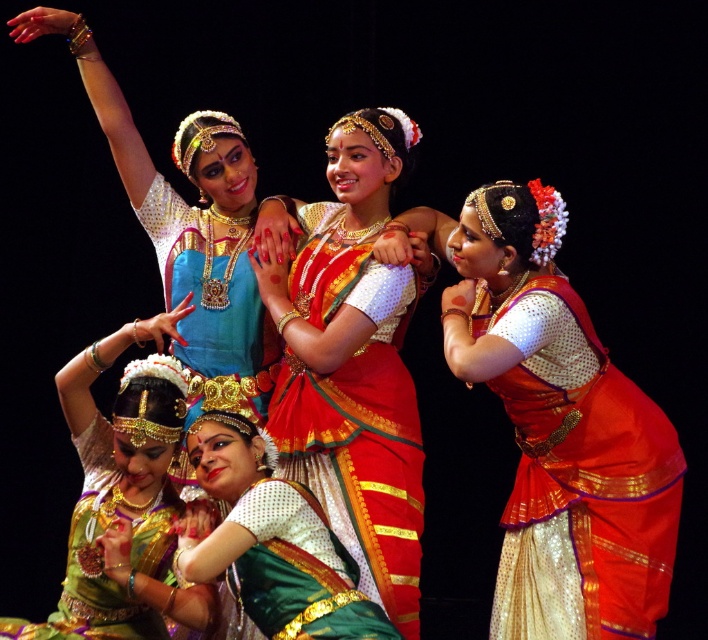
You are a photographer trying to capture the dancers in the scene. You notice two sarees at the center of the image. Which saree has a greater width? The silk saree at center or the silky green saree at center?

The silk saree at center has a greater width than the silky green saree at center according to the description.

You are a photographer trying to capture the dancers in the image. You notice two green sarees at the center of the scene. Which one is positioned lower between the silky green saree at center and the green satin saree at center?

The silky green saree at center is positioned lower than the green satin saree at center because it is located below it.

You are a photographer trying to capture a photo of the dancers. You want to focus on the silky green saree at center and the green satin saree at center. Which one is positioned to the left of the other?

The silky green saree at center is positioned to the left of the green satin saree at center.